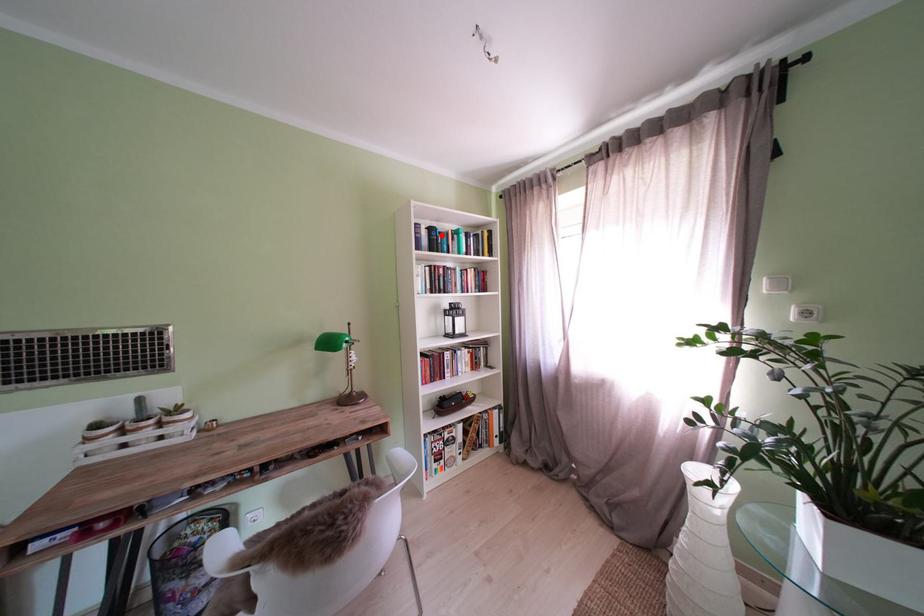
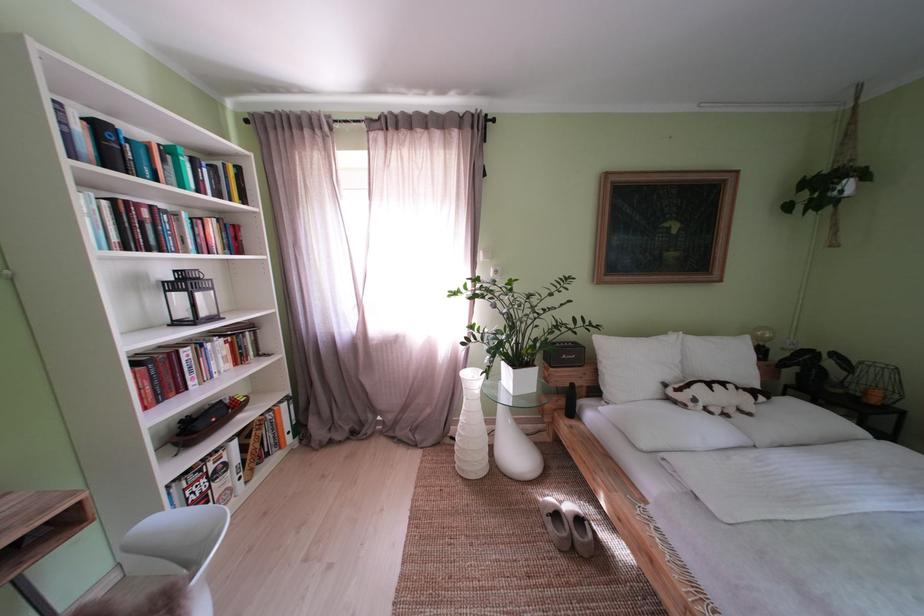
Question: I am providing you with two images of the same scene from different viewpoints. Given a red point in image1, look at the same physical point in image2. Is it:

Choices:
 (A) Closer to the viewpoint
 (B) Farther from the viewpoint

Answer: (B)